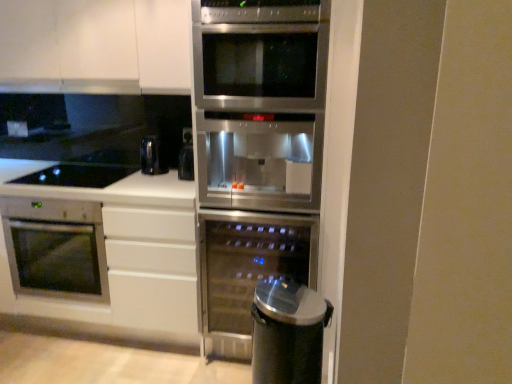
Question: Is black glass cooktop at lower left next to white matte cabinet at upper left?

Choices:
 (A) no
 (B) yes

Answer: (A)

Question: From a real-world perspective, is black glass cooktop at lower left beneath white matte cabinet at upper left?

Choices:
 (A) yes
 (B) no

Answer: (A)

Question: Is black glass cooktop at lower left at the left side of white matte cabinet at upper left?

Choices:
 (A) yes
 (B) no

Answer: (A)

Question: Is the depth of black glass cooktop at lower left greater than that of white matte cabinet at upper left?

Choices:
 (A) yes
 (B) no

Answer: (A)

Question: From a real-world perspective, does black glass cooktop at lower left stand above white matte cabinet at upper left?

Choices:
 (A) no
 (B) yes

Answer: (A)

Question: From the image's perspective, would you say black glass cooktop at lower left is shown under white matte cabinet at upper left?

Choices:
 (A) yes
 (B) no

Answer: (A)

Question: Considering the relative positions of satin silver oven at lower left, which is the 2th oven in right-to-left order, and black glass cooktop at lower left in the image provided, is satin silver oven at lower left, which is the 2th oven in right-to-left order, behind black glass cooktop at lower left?

Choices:
 (A) no
 (B) yes

Answer: (A)

Question: Is satin silver oven at lower left, arranged as the first oven when viewed from the left, to the right of black glass cooktop at lower left from the viewer's perspective?

Choices:
 (A) yes
 (B) no

Answer: (B)

Question: From a real-world perspective, is satin silver oven at lower left, which is the 2th oven in right-to-left order, located higher than black glass cooktop at lower left?

Choices:
 (A) yes
 (B) no

Answer: (B)

Question: From the image's perspective, is satin silver oven at lower left, arranged as the first oven when viewed from the left, on top of black glass cooktop at lower left?

Choices:
 (A) yes
 (B) no

Answer: (B)

Question: Is satin silver oven at lower left, which is the 2th oven in right-to-left order, to the left of black glass cooktop at lower left from the viewer's perspective?

Choices:
 (A) yes
 (B) no

Answer: (A)

Question: Considering the relative sizes of satin silver oven at lower left, which is the 2th oven in right-to-left order, and black glass cooktop at lower left in the image provided, is satin silver oven at lower left, which is the 2th oven in right-to-left order, thinner than black glass cooktop at lower left?

Choices:
 (A) yes
 (B) no

Answer: (B)

Question: Can you confirm if sleek metallic trash can at lower right is shorter than satin stainless steel wine cooler at center, the first oven positioned from the right?

Choices:
 (A) yes
 (B) no

Answer: (A)